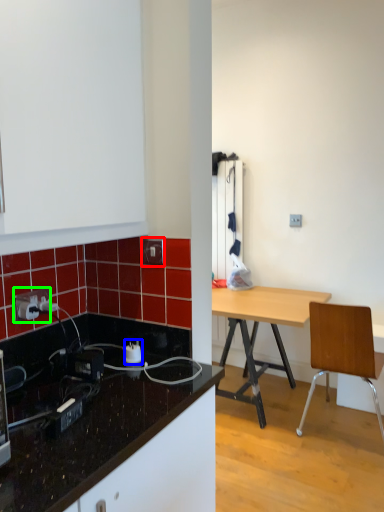
Question: Which is farther away from electric outlet (highlighted by a red box)? power plugs and sockets (highlighted by a blue box) or power outlet (highlighted by a green box)?

Choices:
 (A) power plugs and sockets
 (B) power outlet

Answer: (B)